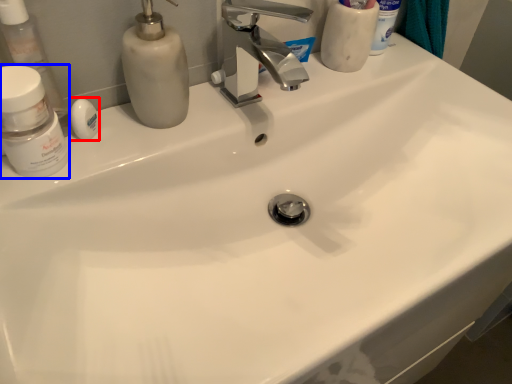
Question: Which point is closer to the camera, soap (highlighted by a red box) or mouthwash (highlighted by a blue box)?

Choices:
 (A) soap
 (B) mouthwash

Answer: (B)